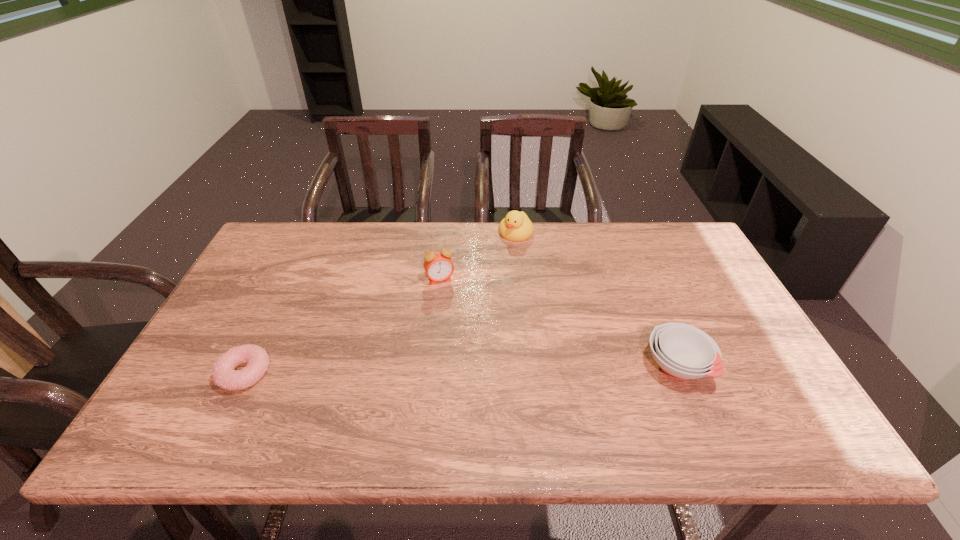
Where is `free space between the leftmost object and the third nearest object`? This screenshot has width=960, height=540. free space between the leftmost object and the third nearest object is located at coordinates (343, 326).

Locate an element on the screen. free space between the alarm clock and the farthest object is located at coordinates (478, 256).

Identify the location of blank region between the alarm clock and the soup bowl. (559, 323).

Locate an element on the screen. vacant area between the alarm clock and the rightmost object is located at coordinates (559, 323).

You are a GUI agent. You are given a task and a screenshot of the screen. Output one action in this format:
    pyautogui.click(x=<x>, y=<y>)
    Task: Click on the free spot between the third tallest object and the alarm clock
    
    Given the screenshot: What is the action you would take?
    pyautogui.click(x=559, y=323)

Locate an element on the screen. This screenshot has height=540, width=960. vacant space that's between the second object from right to left and the second farthest object is located at coordinates (478, 256).

The height and width of the screenshot is (540, 960). Identify the location of vacant point located between the third nearest object and the farthest object. (478, 256).

At what (x,y) coordinates should I click in order to perform the action: click on free space between the shortest object and the third nearest object. Please return your answer as a coordinate pair (x, y). Looking at the image, I should click on (343, 326).

Image resolution: width=960 pixels, height=540 pixels. I want to click on unoccupied area between the third object from right to left and the second tallest object, so click(x=478, y=256).

Select which object appears as the closest to the shortest object. Please provide its 2D coordinates. Your answer should be formatted as a tuple, i.e. [(x, y)], where the tuple contains the x and y coordinates of a point satisfying the conditions above.

[(438, 266)]